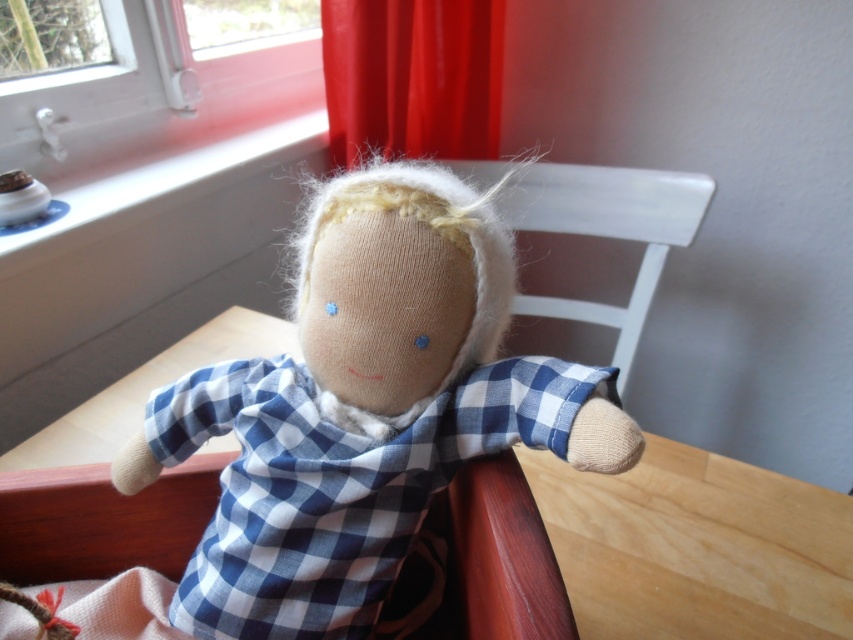
Is woolen doll at center above red velvet curtain at upper center?

Incorrect, woolen doll at center is not positioned above red velvet curtain at upper center.

Does woolen doll at center appear on the right side of red velvet curtain at upper center?

Incorrect, woolen doll at center is not on the right side of red velvet curtain at upper center.

Does point (379, 307) come farther from viewer compared to point (341, 83)?

No, (379, 307) is in front of (341, 83).

At what (x,y) coordinates should I click in order to perform the action: click on woolen doll at center. Please return your answer as a coordinate pair (x, y). Looking at the image, I should click on (367, 413).

Is point (140, 28) positioned after point (415, 80)?

No, it is not.

Is smooth white window sill at upper left taller than red velvet curtain at upper center?

Indeed, smooth white window sill at upper left has a greater height compared to red velvet curtain at upper center.

This screenshot has width=853, height=640. Describe the element at coordinates (148, 108) in the screenshot. I see `smooth white window sill at upper left` at that location.

Identify the location of smooth white window sill at upper left. (148, 108).

Who is lower down, smooth white window sill at upper left or white wood chair at center?

white wood chair at center is lower down.

Does smooth white window sill at upper left have a greater width compared to white wood chair at center?

In fact, smooth white window sill at upper left might be narrower than white wood chair at center.

This screenshot has width=853, height=640. Identify the location of smooth white window sill at upper left. (148, 108).